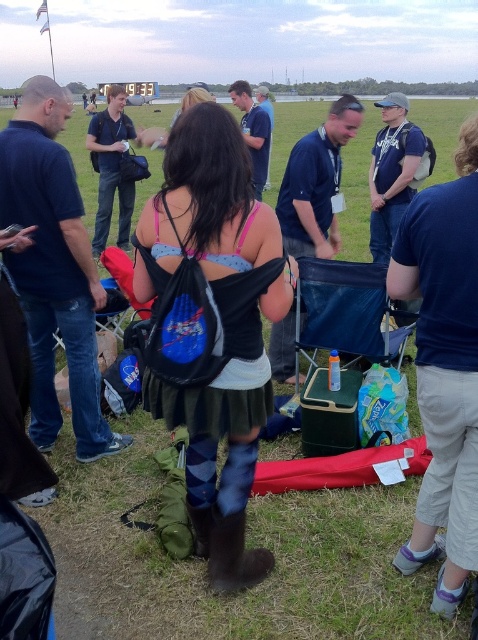
You are standing at the back of the scene and want to greet both the person wearing the dark blue shirt at left and the person wearing the blue denim shirt at center. Which person will you need to walk towards first to reach them?

You will need to walk towards the dark blue shirt at left first because it is positioned under the blue denim shirt at center, meaning it is closer to your current position at the back of the scene.